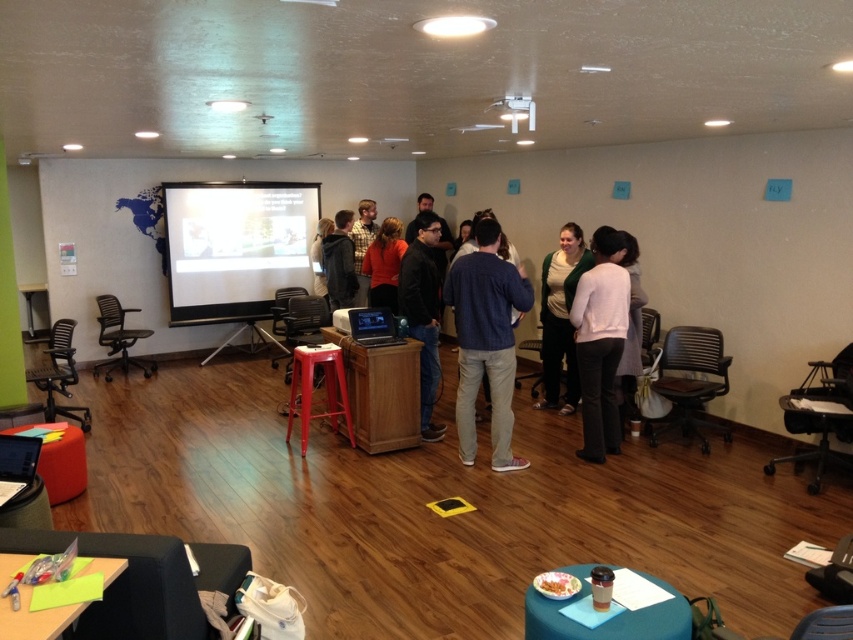
You are organizing a small event and need to place a decorative item between the knit sweater at center and the metallic red stool at center. The decorative item must be exactly 2 feet wide. Can you fit it between them?

The distance between the knit sweater at center and the metallic red stool at center is 3.79 feet. Since the decorative item is 2 feet wide, there is enough space to place it between them as 2 feet is less than 3.79 feet.

You are attending a meeting in this room and need to hand a document to the person wearing the matte green sweater at center. However, there is a black leather jacket at center in your way. Can you reach the person without moving the jacket?

The black leather jacket at center is behind matte green sweater at center, so you can reach the person wearing the matte green sweater at center without moving the jacket because it is already behind them.